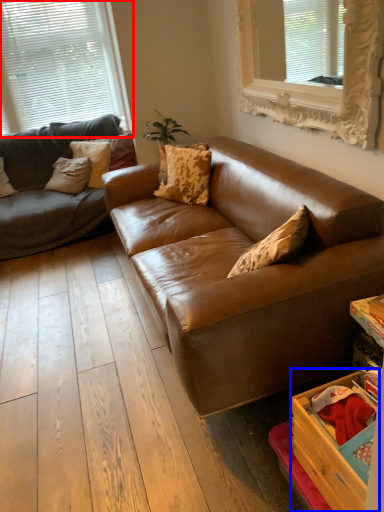
Question: Which of the following is the farthest to the observer, window (highlighted by a red box) or drawer (highlighted by a blue box)?

Choices:
 (A) window
 (B) drawer

Answer: (A)